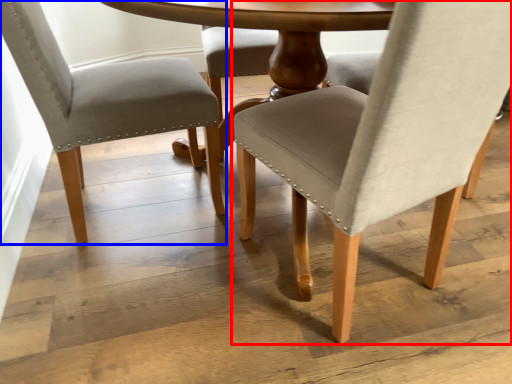
Question: Which object is further to the camera taking this photo, chair (highlighted by a red box) or chair (highlighted by a blue box)?

Choices:
 (A) chair
 (B) chair

Answer: (B)